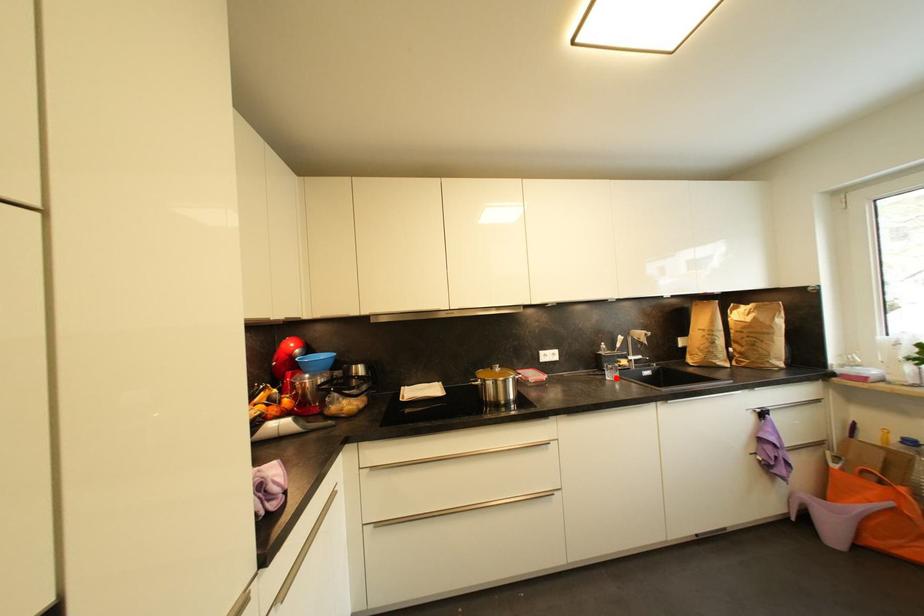
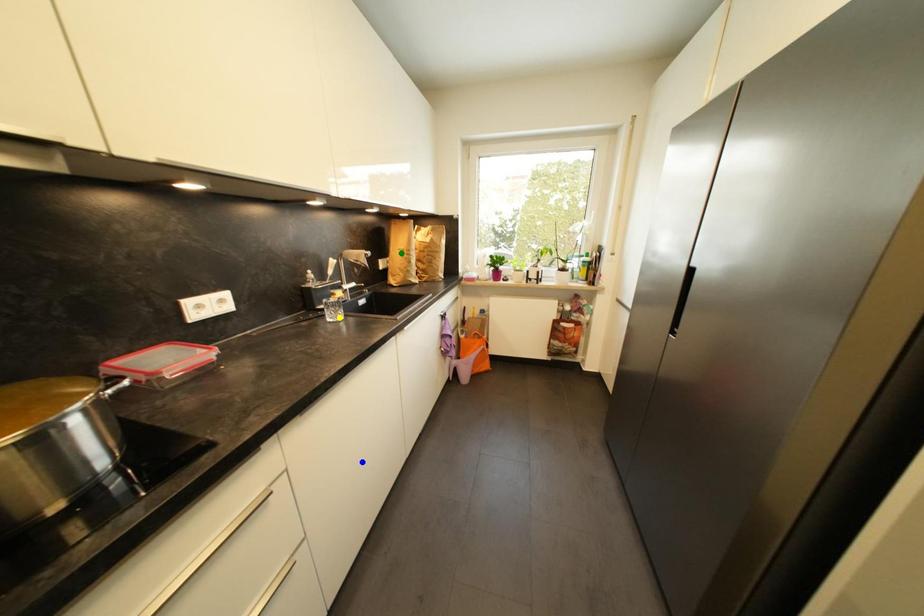
Question: I am providing you with two images of the same scene from different viewpoints. A red point is marked on the first image. You are given multiple points on the second image. Which point in image 2 represents the same 3d spot as the red point in image 1?

Choices:
 (A) yellow point
 (B) green point
 (C) blue point

Answer: (A)